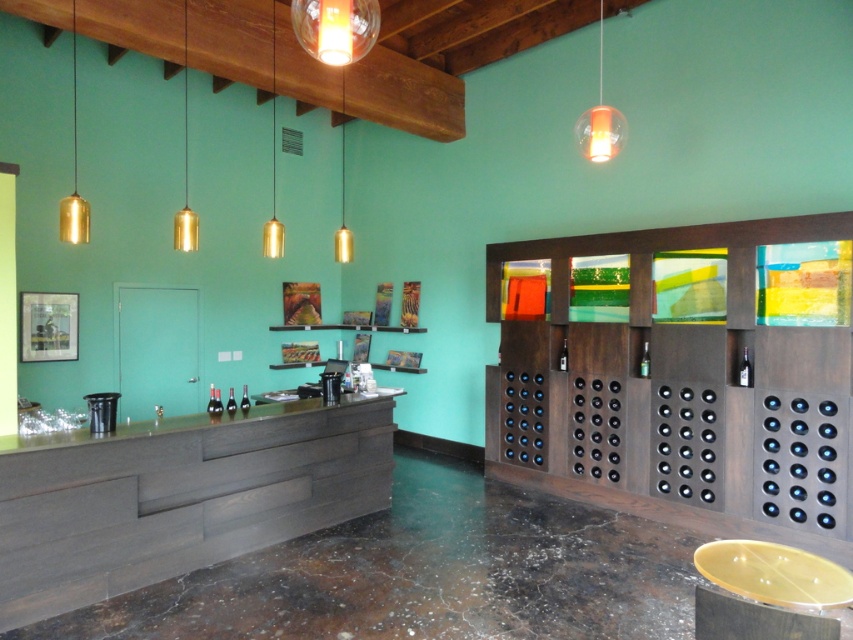
Is smooth wood counter at center behind translucent orange glass pendant light at upper right?

No.

The height and width of the screenshot is (640, 853). What do you see at coordinates (230, 426) in the screenshot?
I see `smooth wood counter at center` at bounding box center [230, 426].

Is point (241, 442) closer to camera compared to point (602, 124)?

No.

Locate an element on the screen. This screenshot has width=853, height=640. smooth wood counter at center is located at coordinates (230, 426).

Between dark wood counter at center and smooth wood counter at center, which one has less height?

With less height is smooth wood counter at center.

Which of these two, dark wood counter at center or smooth wood counter at center, stands taller?

Standing taller between the two is dark wood counter at center.

Identify the location of dark wood counter at center. (178, 497).

What are the coordinates of `dark wood counter at center` in the screenshot? It's located at (178, 497).

Is dark wood counter at center smaller than translucent orange glass pendant light at upper right?

Actually, dark wood counter at center might be larger than translucent orange glass pendant light at upper right.

Who is higher up, dark wood counter at center or translucent orange glass pendant light at upper right?

translucent orange glass pendant light at upper right

Who is more distant from viewer, (93, 573) or (622, 145)?

The point (622, 145) is more distant.

Locate an element on the screen. dark wood counter at center is located at coordinates (178, 497).